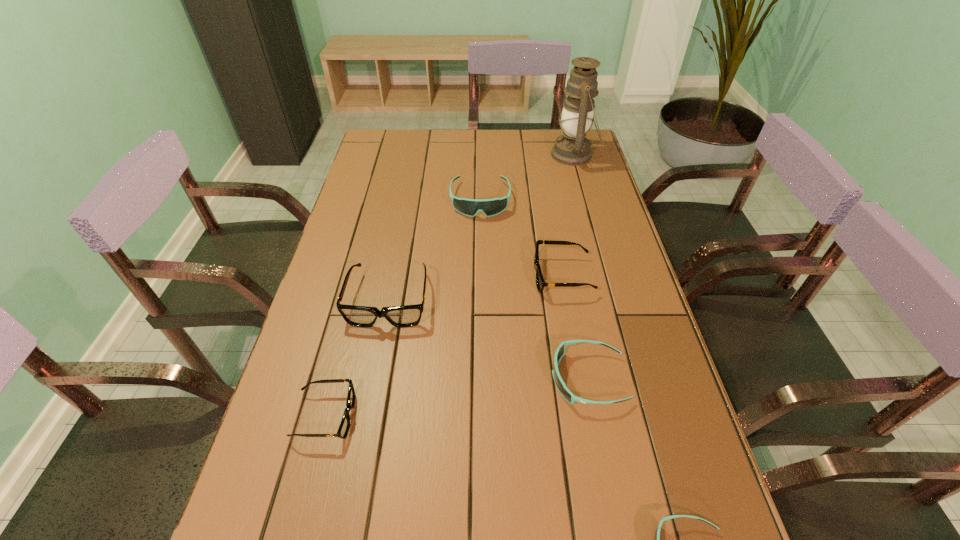
The height and width of the screenshot is (540, 960). In order to click on the third closest cyan sunglasses relative to the biggest black sunglasses in this screenshot , I will do `click(657, 533)`.